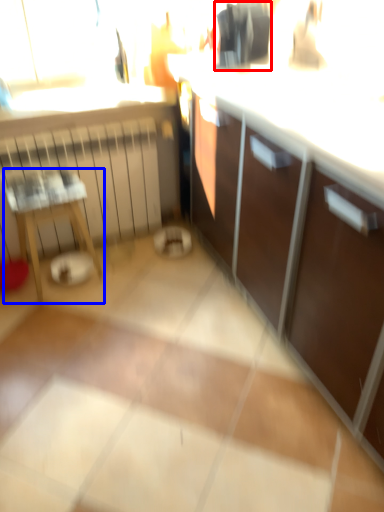
Question: Which point is further to the camera, appliance (highlighted by a red box) or furniture (highlighted by a blue box)?

Choices:
 (A) appliance
 (B) furniture

Answer: (B)